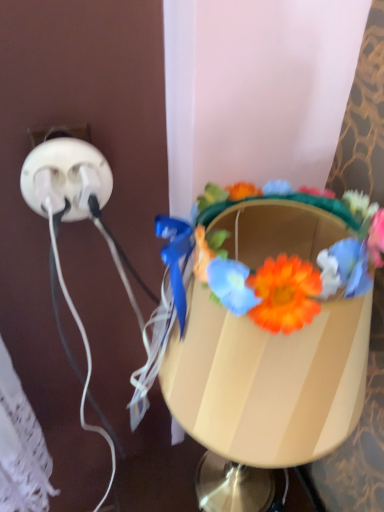
This screenshot has height=512, width=384. What do you see at coordinates (270, 331) in the screenshot? I see `matte plastic table lamp at center` at bounding box center [270, 331].

Where is `floral crown at center`? floral crown at center is located at coordinates pyautogui.click(x=291, y=273).

From a real-world perspective, is floral crown at center on matte plastic table lamp at center?

Yes, from a real-world perspective, floral crown at center is above matte plastic table lamp at center.

Is floral crown at center oriented away from matte plastic table lamp at center?

Yes.

Is floral crown at center situated inside matte plastic table lamp at center or outside?

floral crown at center lies within the bounds of matte plastic table lamp at center.

In order to click on flower that appears above the matte plastic table lamp at center (from the image's perspective) in this screenshot , I will do `click(291, 273)`.

Is white plastic power plugs at left to the left of floral crown at center from the viewer's perspective?

Yes.

Is the depth of white plastic power plugs at left less than that of floral crown at center?

No.

Consider the image. From a real-world perspective, which is physically above, white plastic power plugs at left or floral crown at center?

floral crown at center, from a real-world perspective.

Can you tell me how much white plastic power plugs at left and floral crown at center differ in facing direction?

They differ by 88.7 degrees in their facing directions.

Is floral crown at center closer to camera compared to white plastic power plugs at left?

Yes, floral crown at center is closer to the camera.

In terms of width, does floral crown at center look wider or thinner when compared to white plastic power plugs at left?

In the image, floral crown at center appears to be wider than white plastic power plugs at left.

Which of these two, floral crown at center or white plastic power plugs at left, is bigger?

Bigger between the two is floral crown at center.

Considering the sizes of objects floral crown at center and white plastic power plugs at left in the image provided, who is taller, floral crown at center or white plastic power plugs at left?

With more height is white plastic power plugs at left.

The image size is (384, 512). I want to click on flower that is behind the matte plastic table lamp at center, so click(291, 273).

From their relative heights in the image, would you say matte plastic table lamp at center is taller or shorter than floral crown at center?

In the image, matte plastic table lamp at center appears to be taller than floral crown at center.

Is point (236, 222) closer to viewer compared to point (290, 278)?

That is False.

Considering the relative sizes of matte plastic table lamp at center and floral crown at center in the image provided, is matte plastic table lamp at center wider than floral crown at center?

Indeed, matte plastic table lamp at center has a greater width compared to floral crown at center.

From the image's perspective, which object appears higher, matte plastic table lamp at center or white plastic power plugs at left?

From the image's view, white plastic power plugs at left is above.

From the picture: Would you consider matte plastic table lamp at center to be distant from white plastic power plugs at left?

No, there isn't a large distance between matte plastic table lamp at center and white plastic power plugs at left.

Is white plastic power plugs at left inside matte plastic table lamp at center?

That's incorrect, white plastic power plugs at left is not inside matte plastic table lamp at center.

The image size is (384, 512). What are the coordinates of `table lamp to the right of white plastic power plugs at left` in the screenshot? It's located at (270, 331).

How far apart are white plastic power plugs at left and matte plastic table lamp at center?

They are 26.89 centimeters apart.

Considering the relative sizes of white plastic power plugs at left and matte plastic table lamp at center in the image provided, is white plastic power plugs at left thinner than matte plastic table lamp at center?

Yes, white plastic power plugs at left is thinner than matte plastic table lamp at center.

Is white plastic power plugs at left facing towards matte plastic table lamp at center?

No, white plastic power plugs at left does not turn towards matte plastic table lamp at center.

Image resolution: width=384 pixels, height=512 pixels. What are the coordinates of `flower behind the matte plastic table lamp at center` in the screenshot? It's located at (291, 273).

Identify the location of flower located in front of the white plastic power plugs at left. (291, 273).

Considering their positions, is white plastic power plugs at left positioned closer to matte plastic table lamp at center than floral crown at center?

floral crown at center is positioned closer to the anchor matte plastic table lamp at center.

Based on their spatial positions, is floral crown at center or white plastic power plugs at left further from matte plastic table lamp at center?

white plastic power plugs at left is further to matte plastic table lamp at center.

Based on their spatial positions, is matte plastic table lamp at center or white plastic power plugs at left further from floral crown at center?

white plastic power plugs at left is further to floral crown at center.

When comparing their distances from white plastic power plugs at left, does floral crown at center or matte plastic table lamp at center seem closer?

floral crown at center is closer to white plastic power plugs at left.

Which object lies further to the anchor point floral crown at center, white plastic power plugs at left or matte plastic table lamp at center?

white plastic power plugs at left is further to floral crown at center.

Looking at the image, which one is located closer to white plastic power plugs at left, matte plastic table lamp at center or floral crown at center?

floral crown at center lies closer to white plastic power plugs at left than the other object.

The height and width of the screenshot is (512, 384). Identify the location of flower between white plastic power plugs at left and matte plastic table lamp at center vertically. (291, 273).